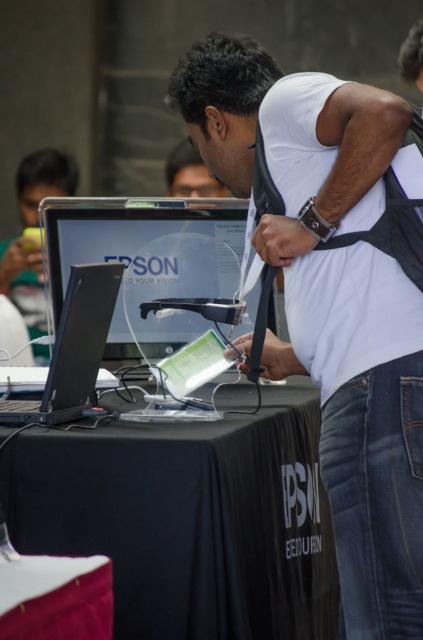
You are a photographer at the Epson exhibition and want to take a photo of the satin black monitor at center and the white matte shirt at upper center. Which object should you focus on first if you want the one closer to the camera to be sharp?

The white matte shirt at upper center should be focused on first because it is closer to the camera than the satin black monitor at center.

You are setting up for an event and need to place a large banner on one of the tables. Which table should you choose between the black fabric table at center and the black fabric table at lower center?

You should choose the black fabric table at center because it is bigger than the black fabric table at lower center, making it more suitable for placing a large banner.

You are a photographer at the Epson exhibition. You need to take a photo of the black fabric table at center and the white matte shirt at upper center. Which object should you focus on first if you want to capture both in the same frame without moving the camera?

The white matte shirt at upper center should be focused on first because it is closer to the camera than the black fabric table at center, which is further away.